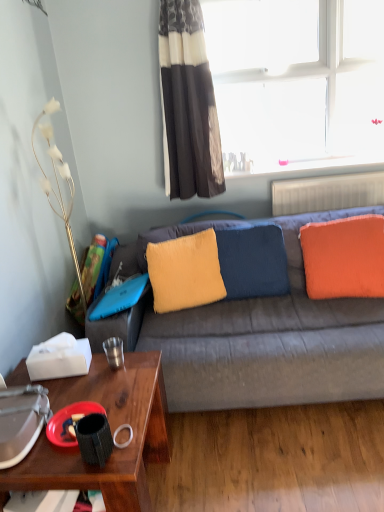
This screenshot has height=512, width=384. In order to click on free spot in front of metallic silver cup at lower left, marked as the 2th coffee cup in a front-to-back arrangement in this screenshot , I will do [103, 387].